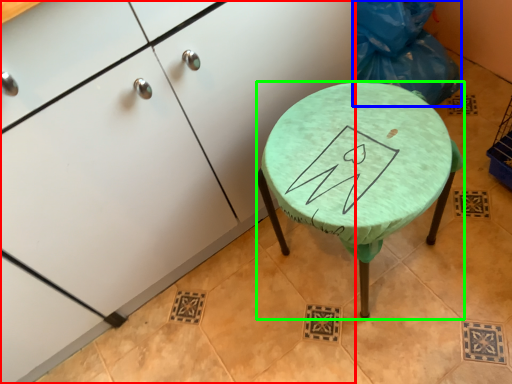
Question: Which object is the closest to the cabinetry (highlighted by a red box)? Choose among these: garbage (highlighted by a blue box) or stool (highlighted by a green box).

Choices:
 (A) garbage
 (B) stool

Answer: (B)